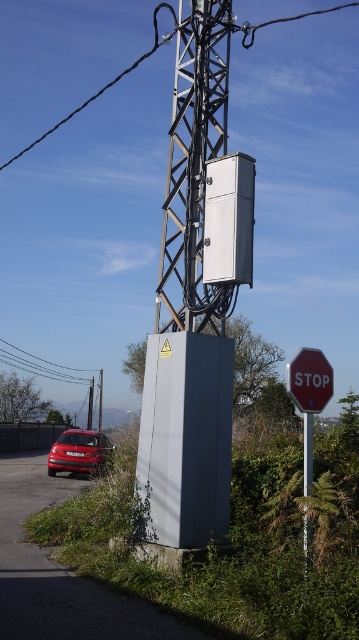
Question: Which point appears closest to the camera in this image?

Choices:
 (A) (286, 376)
 (B) (305, 516)

Answer: (B)

Question: Which is nearer to the gray metallic pole at center?

Choices:
 (A) gray metallic utility box at center
 (B) metallic red car at lower left

Answer: (A)

Question: Is red matte stop sign at center right closer to the viewer compared to gray metallic pole at center?

Choices:
 (A) yes
 (B) no

Answer: (B)

Question: Which point is closer to the camera taking this photo?

Choices:
 (A) (190, 502)
 (B) (48, 369)
 (C) (327, 371)
 (D) (71, 451)

Answer: (C)

Question: Observing the image, what is the correct spatial positioning of metallic wire at upper center in reference to gray metallic pole at center?

Choices:
 (A) right
 (B) left

Answer: (B)

Question: From the image, what is the correct spatial relationship of metallic wire at upper center in relation to gray metallic pole at center?

Choices:
 (A) right
 (B) left

Answer: (B)